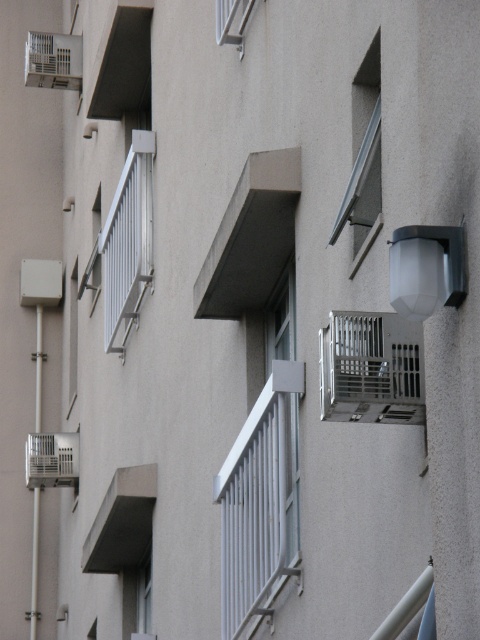
You are standing in front of the residential building and notice the metallic silver air conditioner at right. Can you determine its exact position on the facade using the coordinate system provided?

The metallic silver air conditioner at right is located at point [371,369] according to the coordinate system provided.

In the scene shown: You are a window cleaner who needs to reach both the white metal balcony at upper left and the matte white window at upper center. Based on their sizes, which one will require a larger ladder or equipment to clean?

The white metal balcony at upper left is larger in size than the matte white window at upper center, so it will require a larger ladder or equipment to clean.

You are a window cleaner standing on the ground floor looking up at the building. You need to clean the metallic gray window at upper right and the white metal balcony at upper left. Which object requires you to climb higher to reach?

The metallic gray window at upper right requires climbing higher because it has a greater height compared to the white metal balcony at upper left.